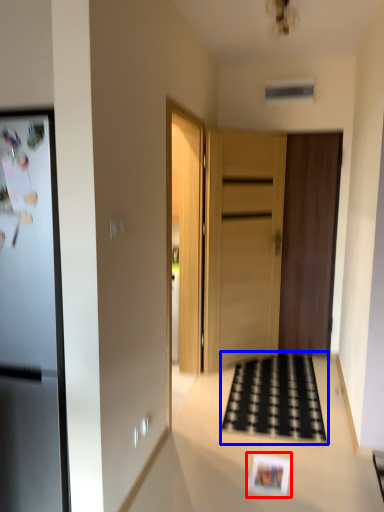
Question: Among these objects, which one is farthest to the camera, postcard (highlighted by a red box) or doormat (highlighted by a blue box)?

Choices:
 (A) postcard
 (B) doormat

Answer: (B)